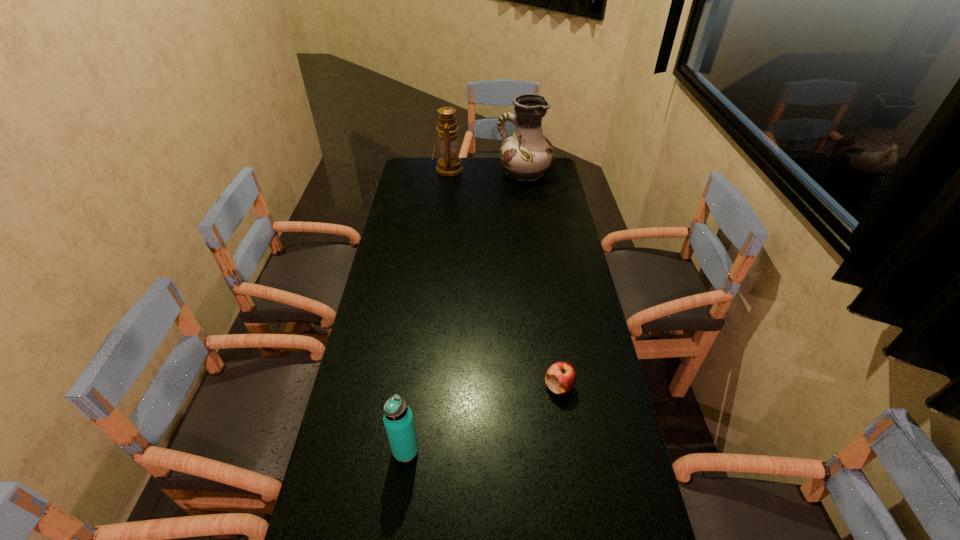
Find the location of a particular element. vacant area that lies between the second tallest object and the second shortest object is located at coordinates (427, 309).

You are a GUI agent. You are given a task and a screenshot of the screen. Output one action in this format:
    pyautogui.click(x=<x>, y=<y>)
    Task: Click on the vacant space that is in between the second nearest object and the vase
    The width and height of the screenshot is (960, 540).
    Given the screenshot: What is the action you would take?
    pyautogui.click(x=541, y=280)

Where is `the second closest object to the third shortest object`? The image size is (960, 540). the second closest object to the third shortest object is located at coordinates (560, 377).

Locate an element on the screen. object that stands as the third closest to the second shortest object is located at coordinates (450, 164).

In order to click on free space that satisfies the following two spatial constraints: 1. on the back side of the third tallest object; 2. on the left side of the third shortest object in this screenshot , I will do 442,169.

Locate an element on the screen. This screenshot has height=540, width=960. vacant region that satisfies the following two spatial constraints: 1. on the front side of the shortest object; 2. on the right side of the vase is located at coordinates (555, 386).

Identify the location of vacant area that satisfies the following two spatial constraints: 1. on the back side of the shortest object; 2. on the left side of the water bottle. Image resolution: width=960 pixels, height=540 pixels. [x=414, y=386].